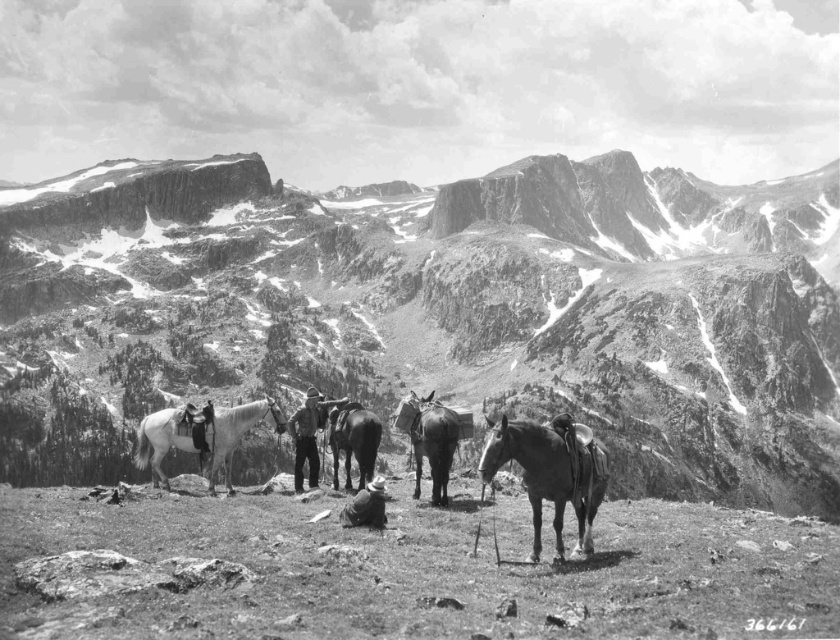
Who is shorter, white leather saddle at center or shiny dark brown horse at center?

shiny dark brown horse at center is shorter.

How distant is white leather saddle at center from shiny dark brown horse at center?

white leather saddle at center is 50.04 feet from shiny dark brown horse at center.

From the picture: Who is more forward, (211, 451) or (459, 416)?

Positioned in front is point (211, 451).

Find the location of a particular element. This screenshot has height=640, width=840. white leather saddle at center is located at coordinates (201, 436).

Who is lower down, shiny brown horse at center or white leather saddle at center?

white leather saddle at center is below.

Does point (512, 429) come behind point (155, 477)?

No, it is not.

What do you see at coordinates (550, 472) in the screenshot? This screenshot has width=840, height=640. I see `shiny brown horse at center` at bounding box center [550, 472].

You are a GUI agent. You are given a task and a screenshot of the screen. Output one action in this format:
    pyautogui.click(x=<x>, y=<y>)
    Task: Click on the shiny brown horse at center
    The width and height of the screenshot is (840, 640).
    Given the screenshot: What is the action you would take?
    pyautogui.click(x=550, y=472)

Does rugged stone mountain range at center have a lesser height compared to shiny black donkey at center?

Incorrect, rugged stone mountain range at center's height does not fall short of shiny black donkey at center's.

Who is positioned more to the left, rugged stone mountain range at center or shiny black donkey at center?

shiny black donkey at center

Which is behind, point (516, 355) or point (352, 435)?

The point (516, 355) is more distant.

Find the location of a particular element. The image size is (840, 640). rugged stone mountain range at center is located at coordinates (441, 308).